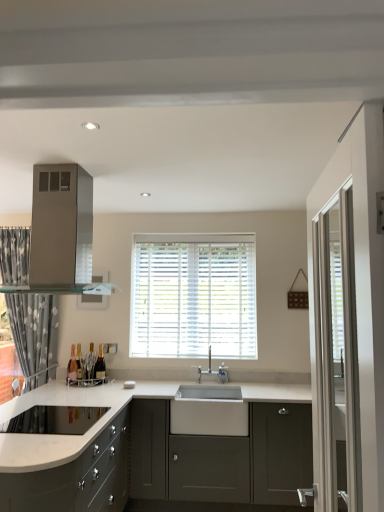
Question: From the image's perspective, is matte gray cabinets at lower left, which is the 1th cabinetry in left-to-right order, above or below satin silver range hood at upper left?

Choices:
 (A) below
 (B) above

Answer: (A)

Question: Considering the positions of matte gray cabinets at lower left, which is the 1th cabinetry in left-to-right order, and satin silver range hood at upper left in the image, is matte gray cabinets at lower left, which is the 1th cabinetry in left-to-right order, taller or shorter than satin silver range hood at upper left?

Choices:
 (A) short
 (B) tall

Answer: (B)

Question: Estimate the real-world distances between objects in this image. Which object is closer to the silver metallic faucet at center?

Choices:
 (A) satin silver range hood at upper left
 (B) matte gray cabinet at center, arranged as the second cabinetry when viewed from the left
 (C) matte gray cabinets at lower left, which is the 1th cabinetry in left-to-right order
 (D) matte glass wine bottle at left, the 1th wine bottle from the left
 (E) white matte sink at center

Answer: (E)

Question: Considering the real-world distances, which object is farthest from the matte gray cabinets at lower left, the 2th cabinetry positioned from the right?

Choices:
 (A) silver metallic faucet at center
 (B) satin silver range hood at upper left
 (C) white wood blinds at center
 (D) white matte sink at center
 (E) matte gray cabinet at center, positioned as the 1th cabinetry in right-to-left order

Answer: (C)